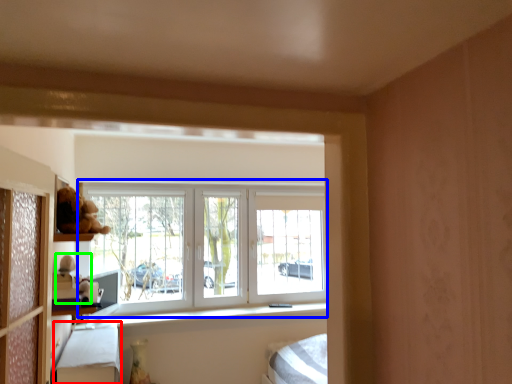
Question: Considering the real-world distances, which object is closest to bed frame (highlighted by a red box)? window (highlighted by a blue box) or toy (highlighted by a green box).

Choices:
 (A) window
 (B) toy

Answer: (B)